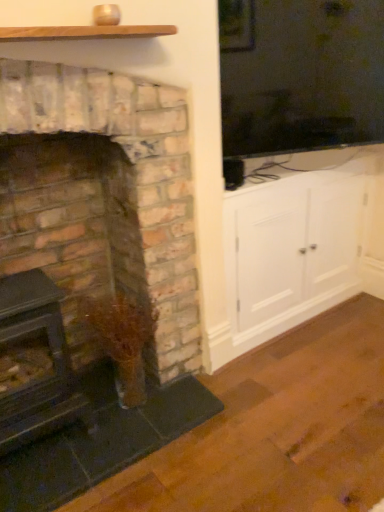
Question: Should I look upward or downward to see white wood cabinet at right?

Choices:
 (A) down
 (B) up

Answer: (B)

Question: Considering the relative positions of white wood cabinet at right and rustic brick fireplace at left, positioned as the 2th fireplace in right-to-left order, in the image provided, is white wood cabinet at right to the left of rustic brick fireplace at left, positioned as the 2th fireplace in right-to-left order, from the viewer's perspective?

Choices:
 (A) no
 (B) yes

Answer: (A)

Question: From a real-world perspective, is white wood cabinet at right below rustic brick fireplace at left, positioned as the 2th fireplace in right-to-left order?

Choices:
 (A) yes
 (B) no

Answer: (A)

Question: Can you confirm if white wood cabinet at right is wider than rustic brick fireplace at left, positioned as the 2th fireplace in right-to-left order?

Choices:
 (A) no
 (B) yes

Answer: (A)

Question: From the image's perspective, is white wood cabinet at right located beneath rustic brick fireplace at left, positioned as the 2th fireplace in right-to-left order?

Choices:
 (A) yes
 (B) no

Answer: (B)

Question: Does white wood cabinet at right have a larger size compared to rustic brick fireplace at left, which appears as the 1th fireplace when viewed from the left?

Choices:
 (A) yes
 (B) no

Answer: (A)

Question: Does white wood cabinet at right turn towards rustic brick fireplace at left, positioned as the 2th fireplace in right-to-left order?

Choices:
 (A) yes
 (B) no

Answer: (B)

Question: From a real-world perspective, is wooden plank at upper center physically above white wood cabinet at right?

Choices:
 (A) no
 (B) yes

Answer: (B)

Question: From the image's perspective, is wooden plank at upper center located beneath white wood cabinet at right?

Choices:
 (A) no
 (B) yes

Answer: (A)

Question: Is the depth of wooden plank at upper center greater than that of white wood cabinet at right?

Choices:
 (A) no
 (B) yes

Answer: (A)

Question: Is wooden plank at upper center wider than white wood cabinet at right?

Choices:
 (A) yes
 (B) no

Answer: (B)

Question: Is wooden plank at upper center completely or partially outside of white wood cabinet at right?

Choices:
 (A) no
 (B) yes

Answer: (B)

Question: Could white wood cabinet at right be considered to be inside wooden plank at upper center?

Choices:
 (A) no
 (B) yes

Answer: (A)

Question: Is rustic brick fireplace at left, the second fireplace in the left-to-right sequence, facing away from rustic brick fireplace at left, positioned as the 2th fireplace in right-to-left order?

Choices:
 (A) no
 (B) yes

Answer: (B)